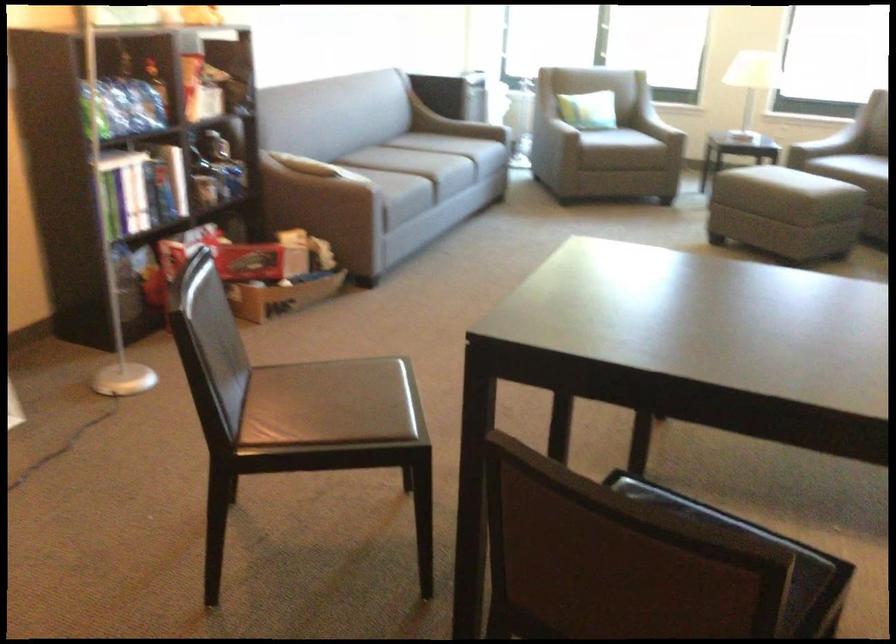
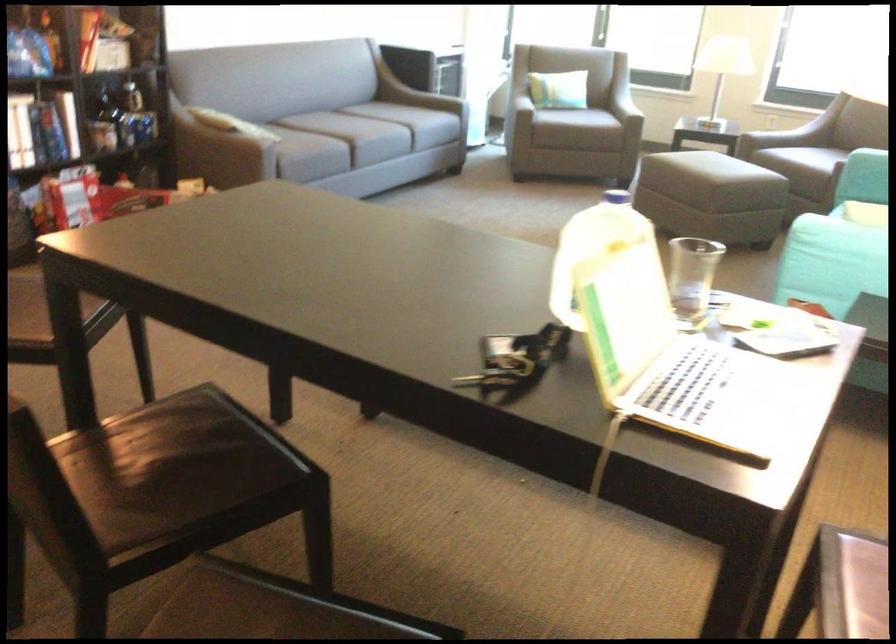
First-person continuous shooting, in which direction is the camera rotating?

The camera's rotation is toward right-down.